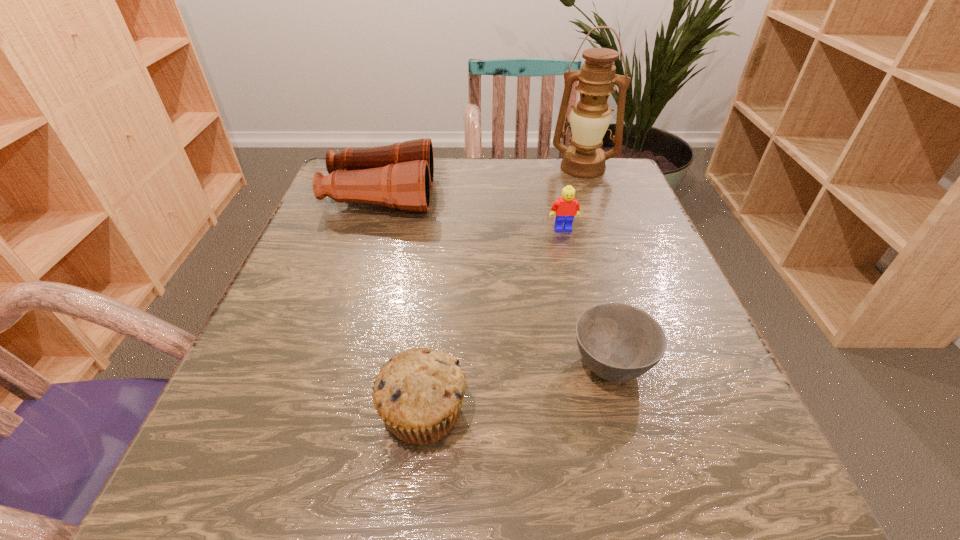
Identify the location of the tallest object. (589, 119).

Identify the location of binoculars. (400, 175).

Where is `the third farthest object`? The image size is (960, 540). the third farthest object is located at coordinates (567, 207).

Identify the location of muffin. (418, 394).

Identify the location of bowl. (618, 342).

This screenshot has height=540, width=960. Identify the location of free space located 0.240m on the left of the tallest object. (456, 167).

Find the location of a particular element. Image resolution: width=960 pixels, height=540 pixels. vacant space situated 0.220m through the lenses of the binoculars is located at coordinates (x=528, y=196).

Find the location of a particular element. This screenshot has height=540, width=960. vacant point located on the front-facing side of the Lego is located at coordinates (569, 258).

Locate an element on the screen. The height and width of the screenshot is (540, 960). vacant space positioned on the left of the muffin is located at coordinates (232, 412).

Locate an element on the screen. free spot located on the left of the bowl is located at coordinates (369, 364).